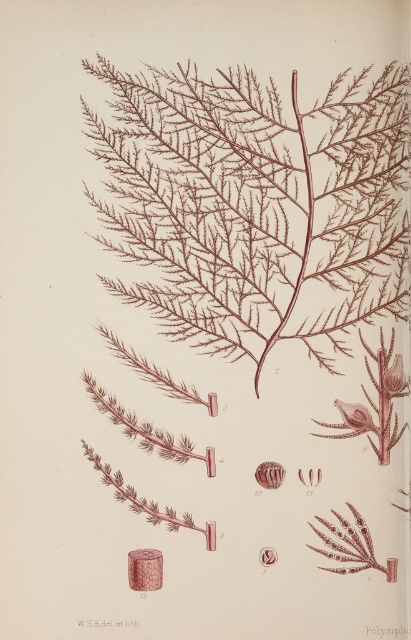
You are a GUI agent. You are given a task and a screenshot of the screen. Output one action in this format:
    pyautogui.click(x=<x>, y=<y>)
    Task: Click on the brown textured plant at center
    The width and height of the screenshot is (411, 640).
    Given the screenshot: What is the action you would take?
    pyautogui.click(x=253, y=204)

Is brown textured plant at center taller than matte pink flower at upper right?

Indeed, brown textured plant at center has a greater height compared to matte pink flower at upper right.

Which is behind, point (350, 269) or point (394, 380)?

The point (350, 269) is behind.

This screenshot has width=411, height=640. I want to click on brown textured plant at center, so click(x=253, y=204).